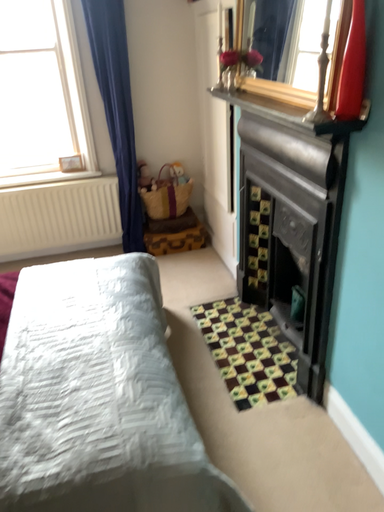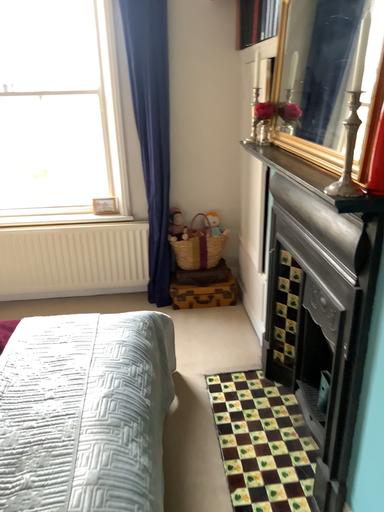
Question: Which way did the camera rotate in the video?

Choices:
 (A) rotated left
 (B) rotated right

Answer: (A)